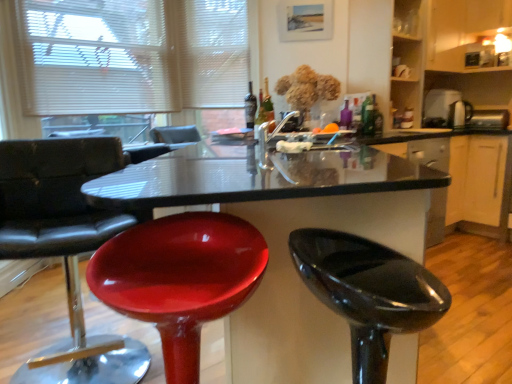
Question: Is black glossy counter at right in front of or behind green glass bottle at upper center, placed as the second bottle when sorted from left to right, in the image?

Choices:
 (A) behind
 (B) front

Answer: (A)

Question: From a real-world perspective, is black glossy counter at right positioned above or below green glass bottle at upper center, marked as the 1th bottle in a front-to-back arrangement?

Choices:
 (A) below
 (B) above

Answer: (A)

Question: Which object is positioned closest to the matte glass bottle at center, which is counted as the third bottle, starting from the front?

Choices:
 (A) metallic silver toaster at right, acting as the third appliance starting from the left
 (B) glossy plastic table at center
 (C) metallic silver toaster at upper right, which appears as the second appliance when viewed from the right
 (D) green glass bottle at upper center, placed as the second bottle when sorted from left to right
 (E) metallic silver toaster at upper right, placed as the 3th appliance when sorted from right to left

Answer: (D)

Question: Considering the real-world distances, which object is closest to the glossy plastic table at center?

Choices:
 (A) matte glass bottle at center, the first bottle viewed from the left
 (B) black glossy counter at right
 (C) green glass bottle at upper center, placed as the second bottle when sorted from left to right
 (D) glossy black stool at lower right, the 1th chair viewed from the right
 (E) metallic silver toaster at upper right, the 2th appliance from the left

Answer: (B)